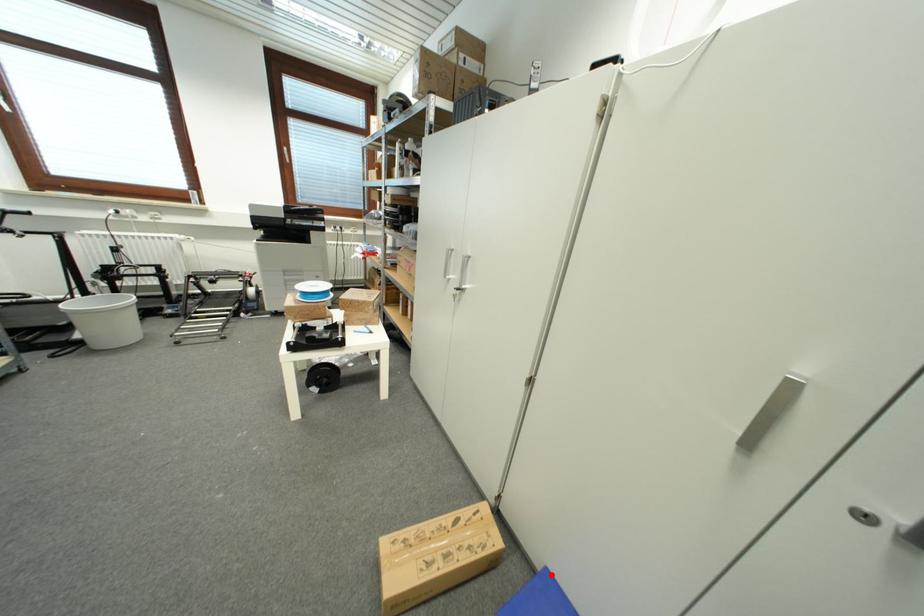
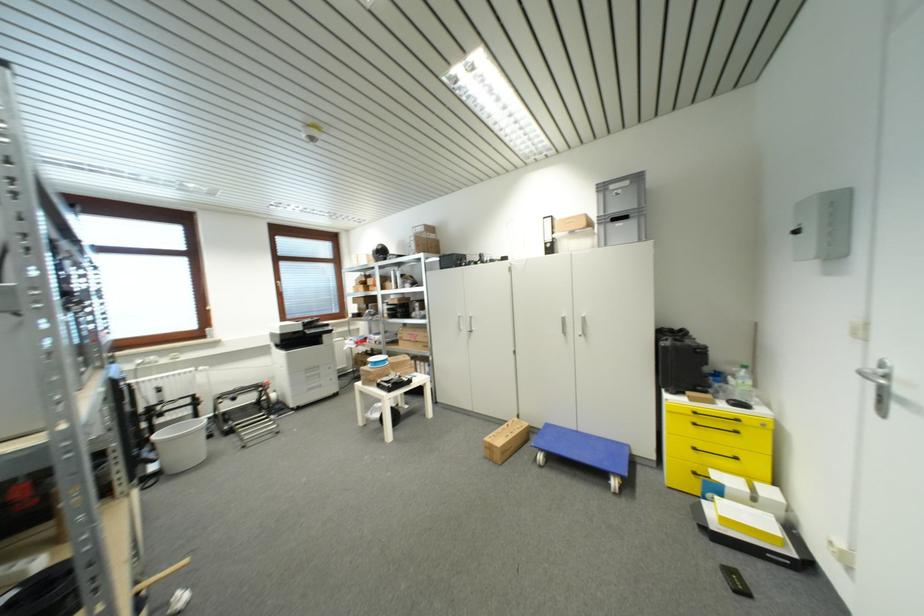
Locate, in the second image, the point that corresponds to the highlighted location in the first image.

(552, 427)